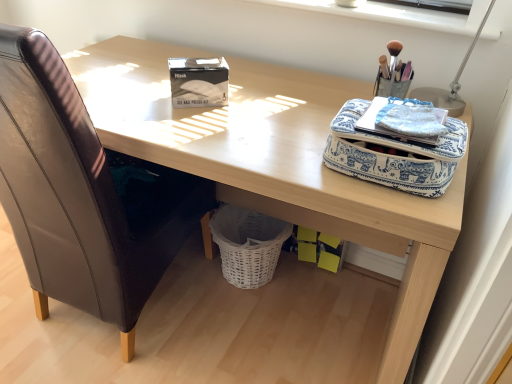
Identify the location of blank space to the left of metallic silver table lamp at upper right. (337, 93).